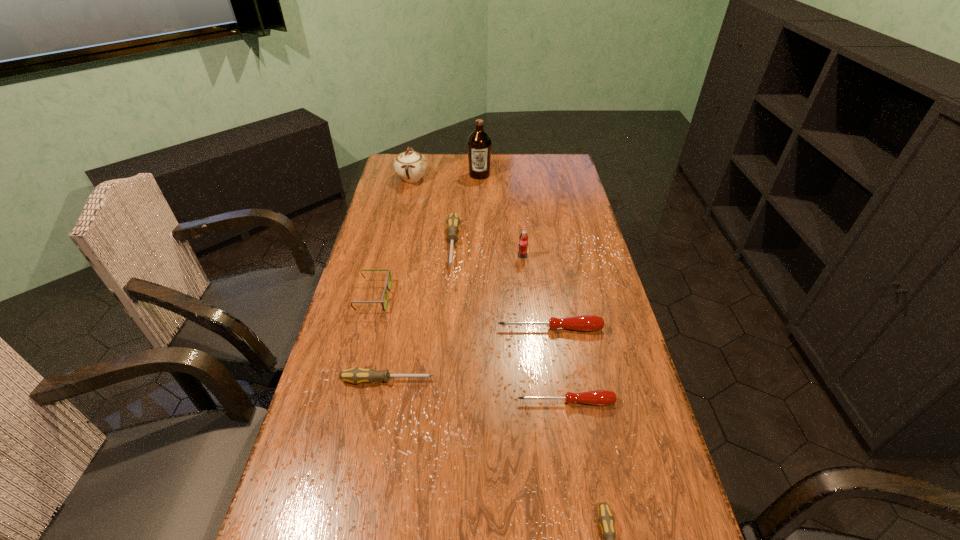
At what (x,y) coordinates should I click in order to perform the action: click on olive oil. Please return your answer as a coordinate pair (x, y). Looking at the image, I should click on (479, 143).

The image size is (960, 540). In order to click on the tallest object in this screenshot , I will do `click(479, 143)`.

This screenshot has width=960, height=540. What are the coordinates of `white chinaware` in the screenshot? It's located at (410, 166).

The height and width of the screenshot is (540, 960). Find the location of `the seventh shortest object`. the seventh shortest object is located at coordinates (523, 239).

Identify the location of the biggest gray screwdriver. (453, 223).

Find the location of a particular element. This screenshot has height=540, width=960. the farthest gray screwdriver is located at coordinates (453, 223).

Find the location of a particular element. The height and width of the screenshot is (540, 960). spectacles is located at coordinates (389, 273).

You are a GUI agent. You are given a task and a screenshot of the screen. Output one action in this format:
    pyautogui.click(x=<x>, y=<y>)
    Task: Click on the black spectacles
    
    Given the screenshot: What is the action you would take?
    pyautogui.click(x=389, y=273)

Where is `the second farthest screwdriver`? Image resolution: width=960 pixels, height=540 pixels. the second farthest screwdriver is located at coordinates (584, 322).

At what (x,y) coordinates should I click in order to perform the action: click on the bigger red screwdriver. Please return your answer as a coordinate pair (x, y). Image resolution: width=960 pixels, height=540 pixels. Looking at the image, I should click on 584,322.